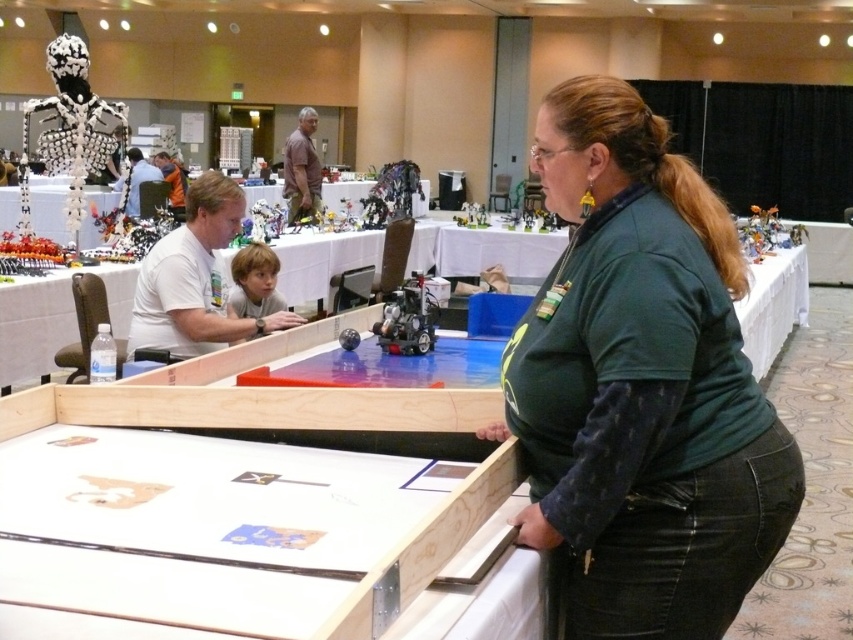
In the scene shown: You are a participant in the robotics competition and need to move a tool from the green fabric shirt at center to the light brown hair at center. The tool is 10 feet long. Will it reach without moving either object?

The distance between the green fabric shirt at center and the light brown hair at center is 8.58 feet, so the 10 foot long tool will reach without needing to move either object.

You are standing in the conference room and need to locate the green fabric shirt at center. According to the coordinates provided, where should you look?

The green fabric shirt at center is located at coordinates point (641, 387).